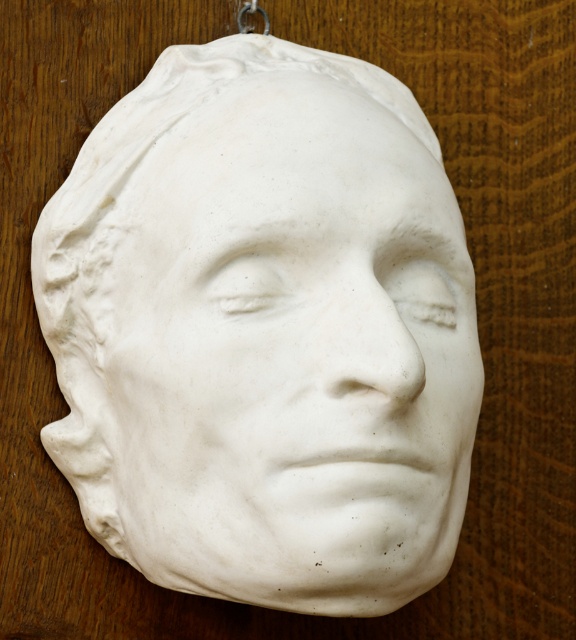
Can you confirm if white marble mask at center is thinner than metallic ring at upper center?

Incorrect, white marble mask at center's width is not less than metallic ring at upper center's.

Who is more distant from viewer, [312,467] or [255,4]?

The point [255,4] is more distant.

Which is behind, point (331, 179) or point (240, 22)?

Point (240, 22)

Where is `white marble mask at center`? white marble mask at center is located at coordinates (264, 330).